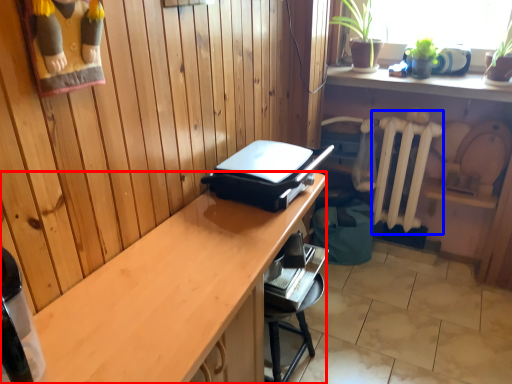
Question: Which object is further to the camera taking this photo, desk (highlighted by a red box) or radiator (highlighted by a blue box)?

Choices:
 (A) desk
 (B) radiator

Answer: (B)